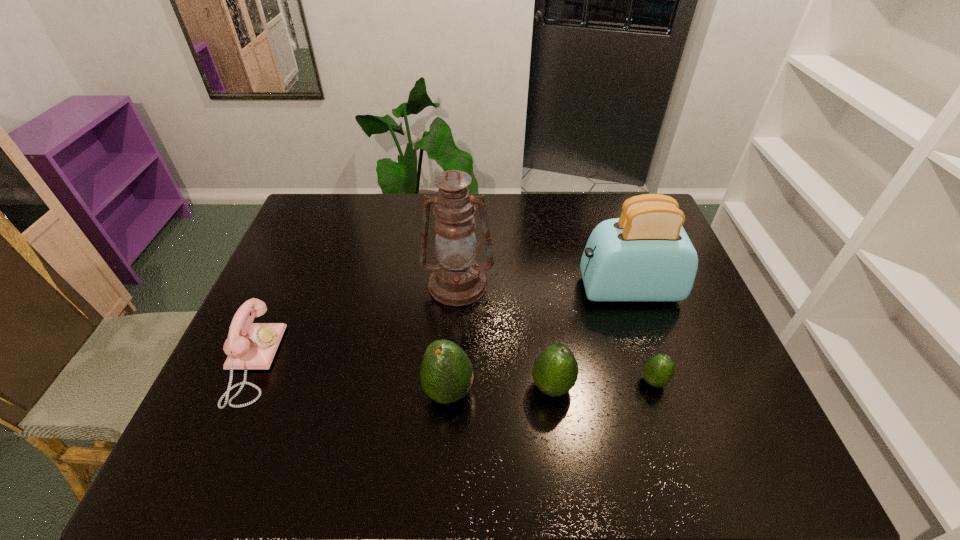
I want to click on vacant space that is in between the second tallest avocado and the toaster, so click(x=589, y=338).

Locate an element on the screen. This screenshot has width=960, height=540. free space that is in between the second tallest object and the rightmost avocado is located at coordinates (640, 335).

Locate an element on the screen. This screenshot has height=540, width=960. blank region between the tallest object and the leftmost object is located at coordinates (354, 324).

Where is `free spot between the second tallest avocado and the leftmost object`? free spot between the second tallest avocado and the leftmost object is located at coordinates (401, 375).

Locate which object ranks in proximity to the telephone. Please provide its 2D coordinates. Your answer should be formatted as a tuple, i.e. [(x, y)], where the tuple contains the x and y coordinates of a point satisfying the conditions above.

[(456, 280)]

Find the location of a particular element. The width and height of the screenshot is (960, 540). object that is the fifth closest to the second tallest avocado is located at coordinates (249, 345).

The width and height of the screenshot is (960, 540). Identify the location of avocado that stands as the second closest to the leftmost avocado. (658, 370).

This screenshot has height=540, width=960. In order to click on avocado that is the third closest to the oil lamp in this screenshot , I will do `click(658, 370)`.

This screenshot has width=960, height=540. Identify the location of vacant space that satisfies the following two spatial constraints: 1. on the side of the fifth shortest object with the lever; 2. on the front side of the third object from right to left. (660, 387).

This screenshot has width=960, height=540. In order to click on free region that satisfies the following two spatial constraints: 1. on the dial of the leftmost object; 2. on the right side of the shortest object in this screenshot , I will do `click(244, 381)`.